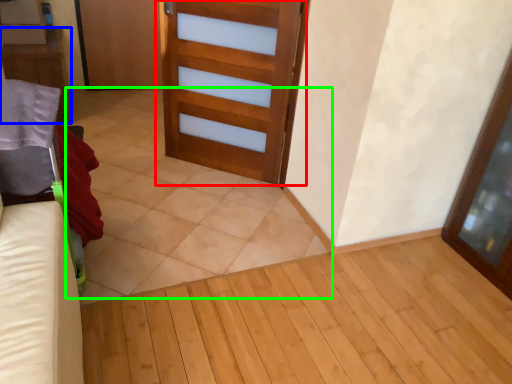
Question: Estimate the real-world distances between objects in this image. Which object is farther from door (highlighted by a red box), furniture (highlighted by a blue box) or tile (highlighted by a green box)?

Choices:
 (A) furniture
 (B) tile

Answer: (A)